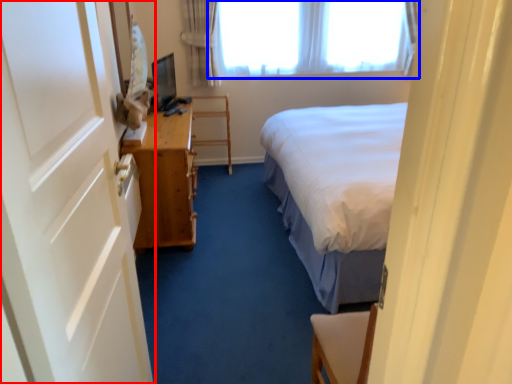
Question: Among these objects, which one is nearest to the camera, door (highlighted by a red box) or window (highlighted by a blue box)?

Choices:
 (A) door
 (B) window

Answer: (A)